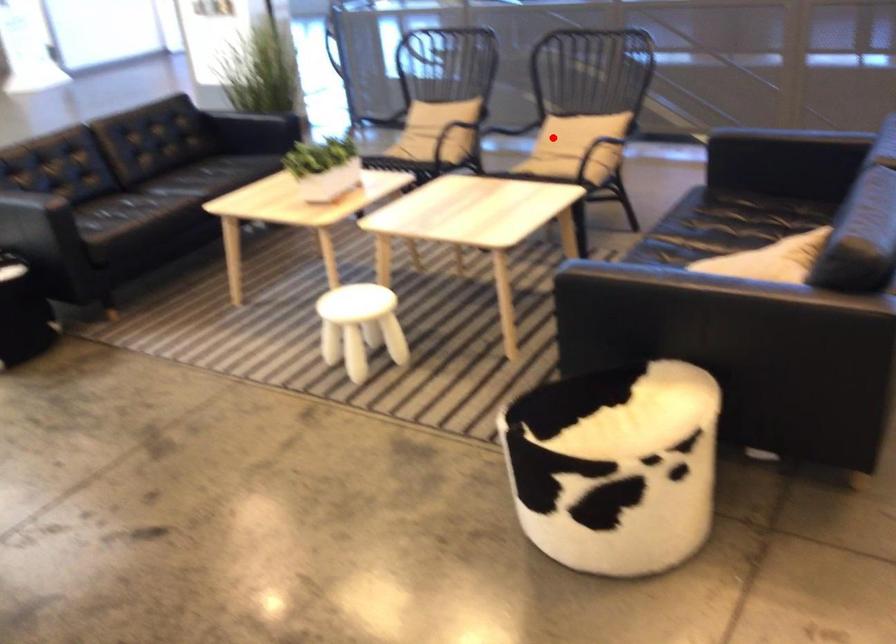
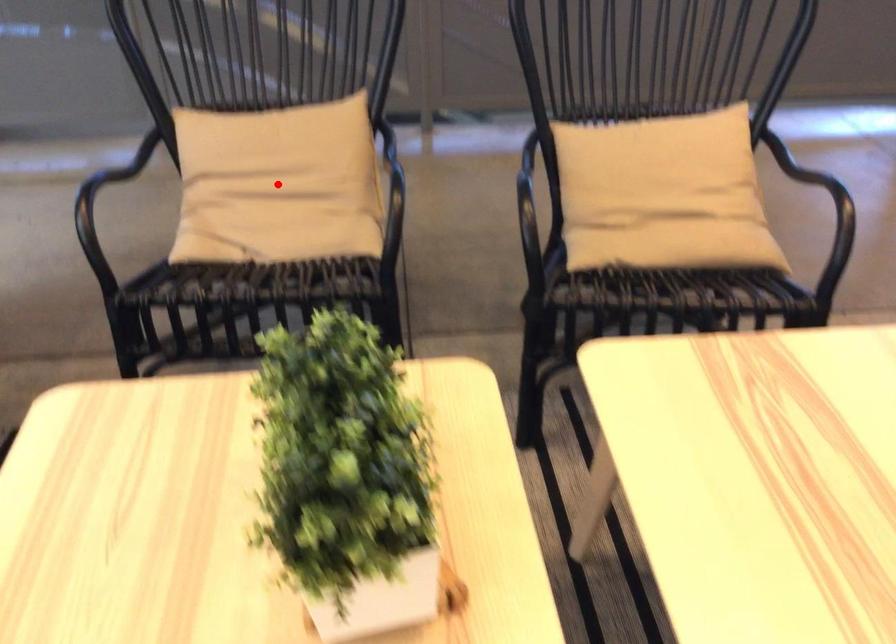
I am providing you with two images of the same scene from different viewpoints. A red point is marked on the first image and another point is marked on the second image. Is the marked point in image1 the same physical position as the marked point in image2?

No